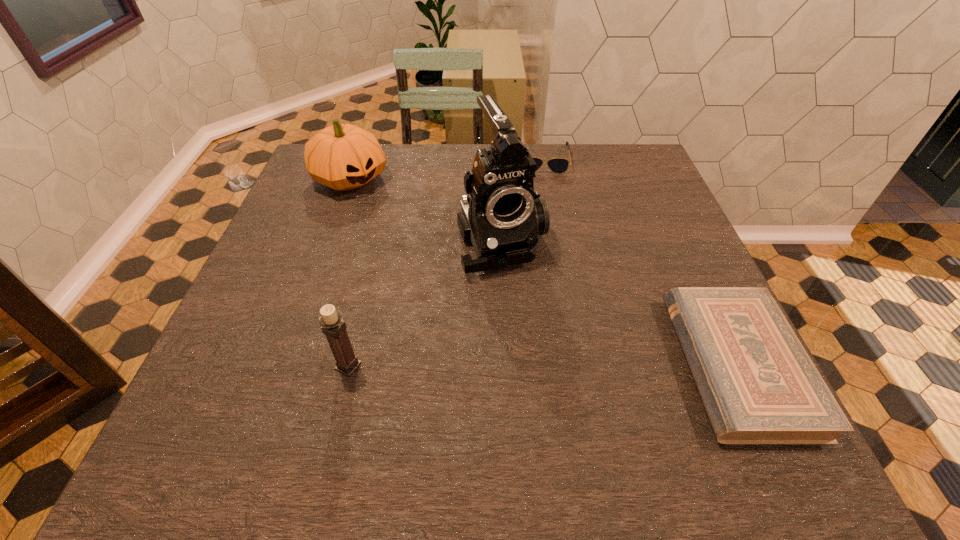
Find the location of a particular element. This screenshot has height=540, width=960. candle holder is located at coordinates (332, 325).

You are a GUI agent. You are given a task and a screenshot of the screen. Output one action in this format:
    pyautogui.click(x=<x>, y=<y>)
    Task: Click on the rightmost object
    
    Given the screenshot: What is the action you would take?
    pyautogui.click(x=758, y=385)

Where is `the tallest object`? the tallest object is located at coordinates (501, 217).

Where is `the third farthest object`? This screenshot has width=960, height=540. the third farthest object is located at coordinates (501, 217).

The height and width of the screenshot is (540, 960). In order to click on gourd in this screenshot , I will do `click(343, 157)`.

You are a GUI agent. You are given a task and a screenshot of the screen. Output one action in this format:
    pyautogui.click(x=<x>, y=<y>)
    Task: Click on the sunglasses
    
    Given the screenshot: What is the action you would take?
    pyautogui.click(x=557, y=165)

Find the location of a particular element. free location located on the right of the candle holder is located at coordinates (526, 366).

Where is `vacant space located on the spine side of the Bible`? vacant space located on the spine side of the Bible is located at coordinates (646, 364).

At what (x,y) coordinates should I click in order to perform the action: click on free location located 0.400m on the spine side of the Bible. Please return your answer as a coordinate pair (x, y). Image resolution: width=960 pixels, height=540 pixels. Looking at the image, I should click on (470, 364).

This screenshot has height=540, width=960. Identify the location of free space located on the spine side of the Bible. coord(561,364).